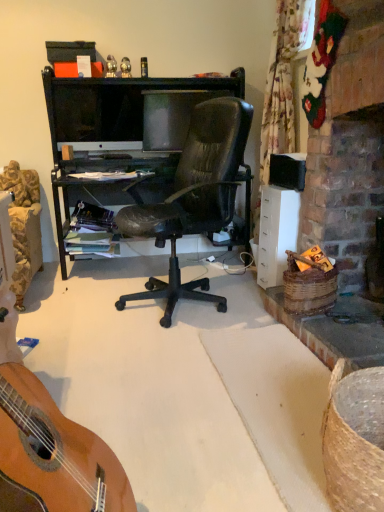
Question: Is point (332, 269) positioned closer to the camera than point (173, 103)?

Choices:
 (A) closer
 (B) farther

Answer: (A)

Question: From a real-world perspective, is brown woven picnic basket at right, the first picnic basket when ordered from top to bottom, positioned above or below matte black monitor at center, marked as the first television in a right-to-left arrangement?

Choices:
 (A) above
 (B) below

Answer: (B)

Question: Which object is positioned farthest from the brown woven picnic basket at lower right, the 1th picnic basket from the front?

Choices:
 (A) matte black monitor at center, which is counted as the 2th television, starting from the right
 (B) light brown wooden guitar at lower left
 (C) matte black monitor at center, which is the second television in left-to-right order
 (D) brown woven picnic basket at right, the 2th picnic basket ordered from the bottom
 (E) matte black box at upper center

Answer: (E)

Question: Considering the real-world distances, which object is closest to the light brown wooden guitar at lower left?

Choices:
 (A) brown woven picnic basket at lower right, which ranks as the 2th picnic basket in back-to-front order
 (B) matte black box at upper center
 (C) matte black monitor at center, which is counted as the 2th television, starting from the right
 (D) matte black monitor at center, which is the second television in left-to-right order
 (E) brown woven picnic basket at right, marked as the first picnic basket in a back-to-front arrangement

Answer: (A)